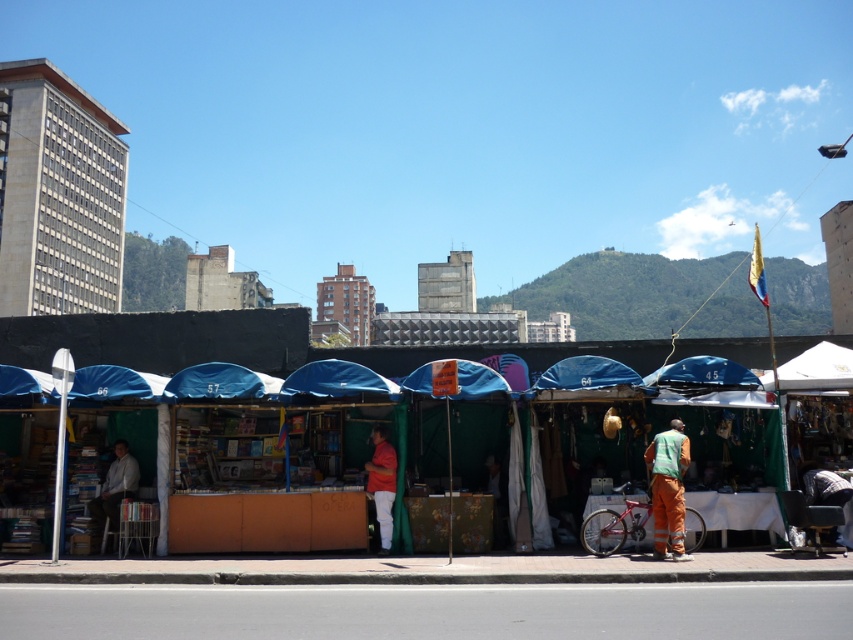
This screenshot has height=640, width=853. What are the coordinates of `orange fabric street vendor at lower right` in the screenshot? It's located at (668, 490).

Based on the photo, is orange fabric street vendor at lower right in front of light gray shirt at left?

Yes, orange fabric street vendor at lower right is closer to the viewer.

At what (x,y) coordinates should I click in order to perform the action: click on orange fabric street vendor at lower right. Please return your answer as a coordinate pair (x, y). The height and width of the screenshot is (640, 853). Looking at the image, I should click on (668, 490).

Is blue fabric market stall at center smaller than light gray shirt at left?

Incorrect, blue fabric market stall at center is not smaller in size than light gray shirt at left.

Which of these two, blue fabric market stall at center or light gray shirt at left, stands taller?

With more height is blue fabric market stall at center.

Which is behind, point (47, 332) or point (91, 506)?

Positioned behind is point (47, 332).

Find the location of a particular element. This screenshot has height=640, width=853. blue fabric market stall at center is located at coordinates (131, 348).

Which is above, blue fabric market stall at center or matte red shirt at center?

blue fabric market stall at center is above.

The width and height of the screenshot is (853, 640). I want to click on blue fabric market stall at center, so click(131, 348).